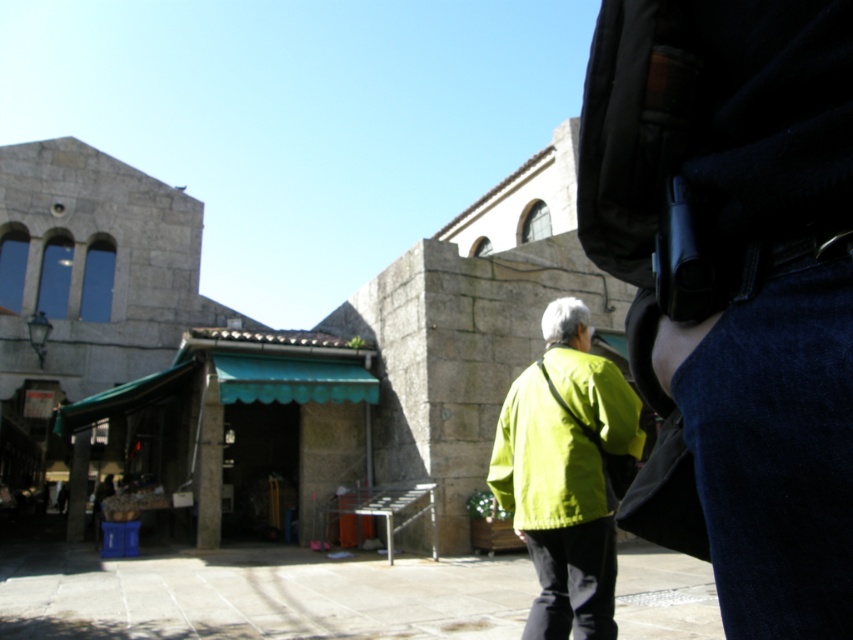
Between smooth concrete alley at center and black leather belt at lower right, which one is positioned lower?

smooth concrete alley at center is lower down.

Does point (364, 596) lie in front of point (799, 266)?

That is False.

Locate an element on the screen. smooth concrete alley at center is located at coordinates (259, 595).

Does black matte jacket at lower right appear under black leather belt at lower right?

Actually, black matte jacket at lower right is above black leather belt at lower right.

Which is more to the right, black matte jacket at lower right or black leather belt at lower right?

black leather belt at lower right

Who is more forward, (692,173) or (773,272)?

Positioned in front is point (773,272).

The width and height of the screenshot is (853, 640). In order to click on black matte jacket at lower right in this screenshot , I will do `click(714, 134)`.

Can you confirm if black matte jacket at lower right is smaller than smooth concrete alley at center?

Yes, black matte jacket at lower right is smaller than smooth concrete alley at center.

Between point (709, 125) and point (318, 618), which one is positioned behind?

The point (318, 618) is more distant.

Locate an element on the screen. black matte jacket at lower right is located at coordinates (714, 134).